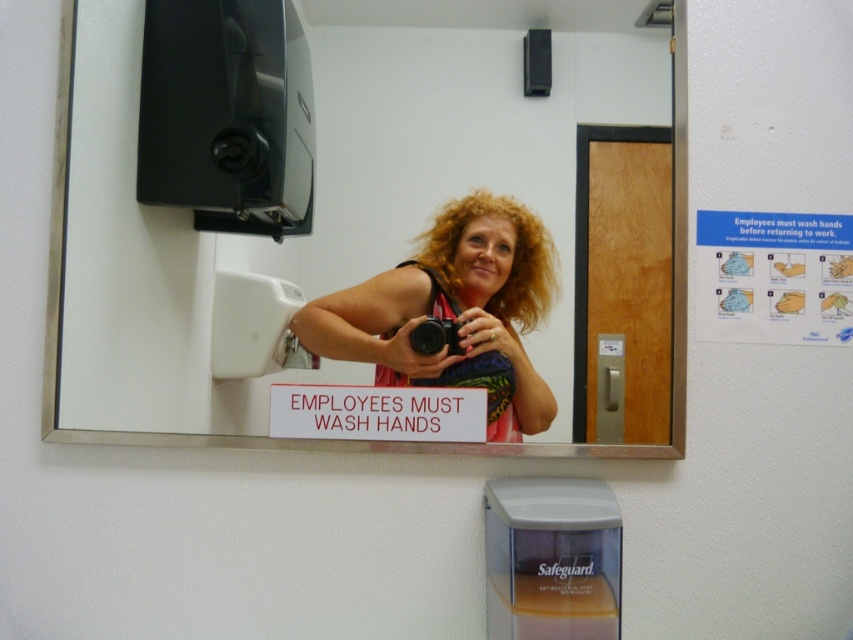
Looking at this image, does multicolored fabric at center have a greater width compared to black plastic camera at center?

Yes.

Based on the photo, is multicolored fabric at center taller than black plastic camera at center?

Yes.

Which is behind, point (486, 339) or point (457, 339)?

The point (486, 339) is more distant.

Find the location of a particular element. multicolored fabric at center is located at coordinates (451, 304).

Is white glossy mirror at upper center wider than multicolored fabric at center?

Yes, white glossy mirror at upper center is wider than multicolored fabric at center.

Between white glossy mirror at upper center and multicolored fabric at center, which one has less height?

multicolored fabric at center

Between point (328, 141) and point (426, 365), which one is positioned behind?

Positioned behind is point (328, 141).

Where is `white glossy mirror at upper center`? This screenshot has width=853, height=640. white glossy mirror at upper center is located at coordinates (378, 240).

From the picture: Is multicolored fabric at center to the left of white plastic sign at center from the viewer's perspective?

In fact, multicolored fabric at center is to the right of white plastic sign at center.

Who is shorter, multicolored fabric at center or white plastic sign at center?

white plastic sign at center

Does point (496, 266) come closer to viewer compared to point (460, 429)?

No, (496, 266) is further to viewer.

This screenshot has height=640, width=853. I want to click on multicolored fabric at center, so coord(451,304).